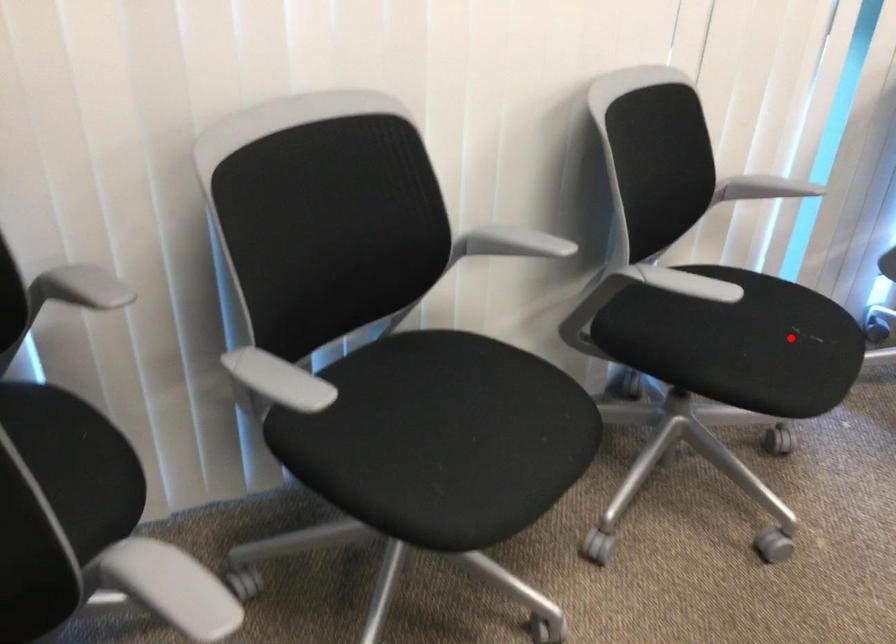
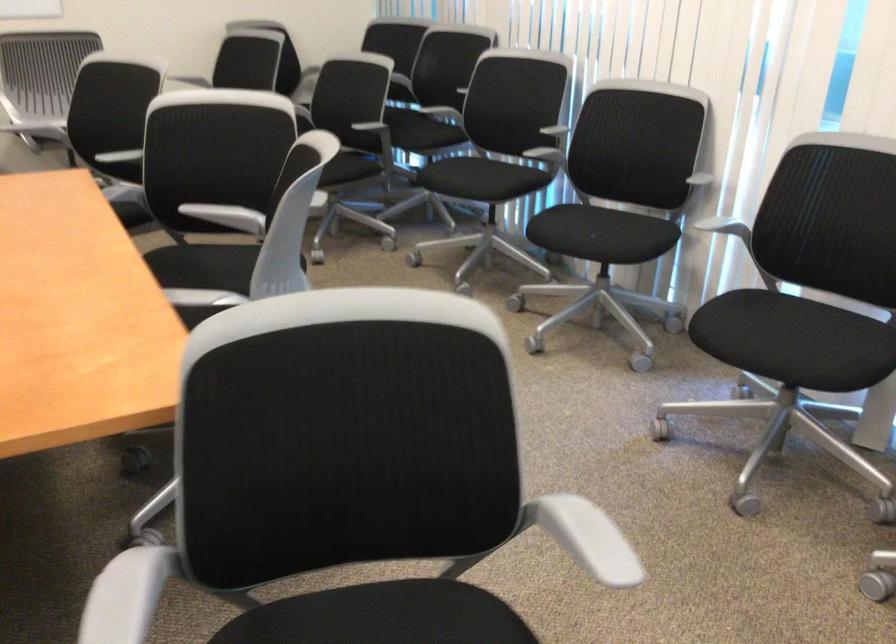
Find the pixel in the second image that matches the highlighted location in the first image.

(582, 232)